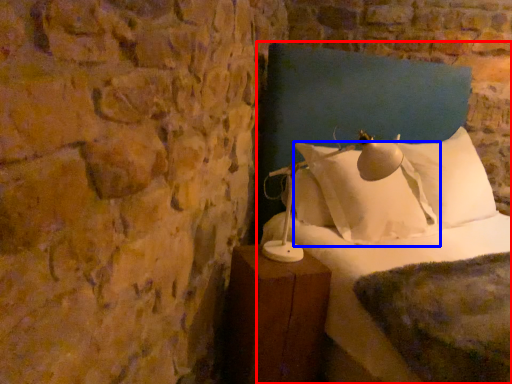
Question: Which point is further to the camera, bed (highlighted by a red box) or pillow (highlighted by a blue box)?

Choices:
 (A) bed
 (B) pillow

Answer: (B)